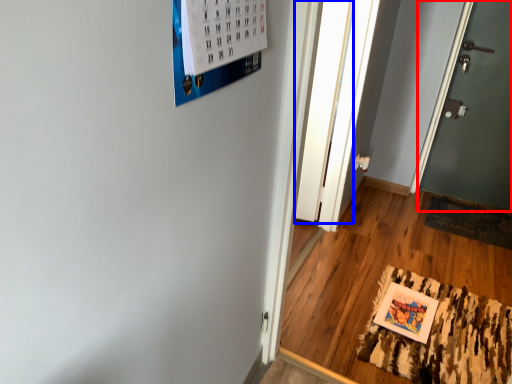
Question: Which object is closer to the camera taking this photo, door (highlighted by a red box) or glass door (highlighted by a blue box)?

Choices:
 (A) door
 (B) glass door

Answer: (B)